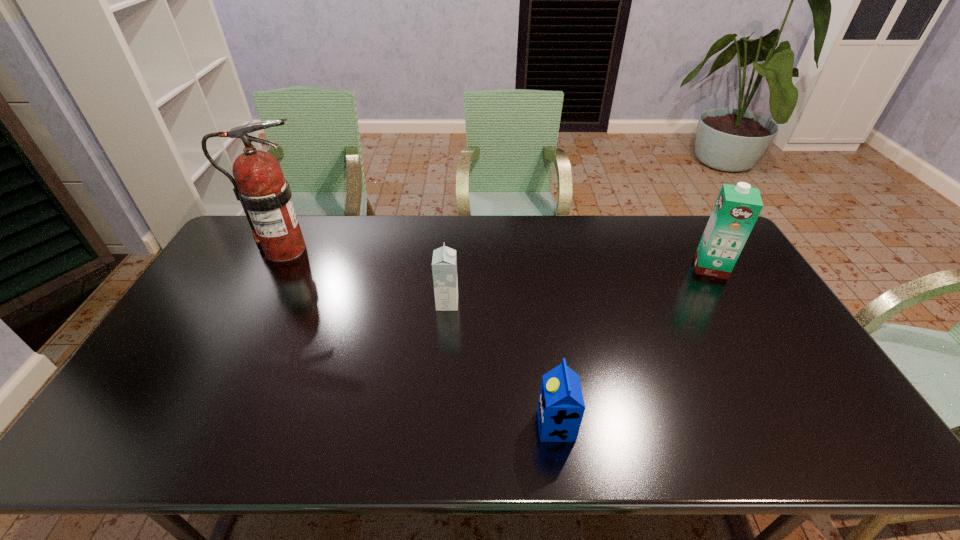
The image size is (960, 540). In order to click on free point located on the front label of the second nearest carton in this screenshot , I will do `click(563, 303)`.

Find the location of a particular element. Image resolution: width=960 pixels, height=540 pixels. vacant area located 0.210m with the cap open on the nearest object is located at coordinates (449, 426).

The width and height of the screenshot is (960, 540). I want to click on vacant space located with the cap open on the nearest object, so click(x=488, y=426).

I want to click on free space located with the cap open on the nearest object, so click(424, 426).

In order to click on object that is at the far edge in this screenshot , I will do `click(265, 195)`.

Where is `object located at the near edge`? This screenshot has height=540, width=960. object located at the near edge is located at coordinates point(561,407).

In order to click on object that is at the left edge in this screenshot , I will do `click(265, 195)`.

This screenshot has width=960, height=540. What are the coordinates of `object situated at the right edge` in the screenshot? It's located at (737, 207).

Locate an element on the screen. The height and width of the screenshot is (540, 960). object situated at the far left corner is located at coordinates (265, 195).

I want to click on blank area at the far edge, so [x=313, y=215].